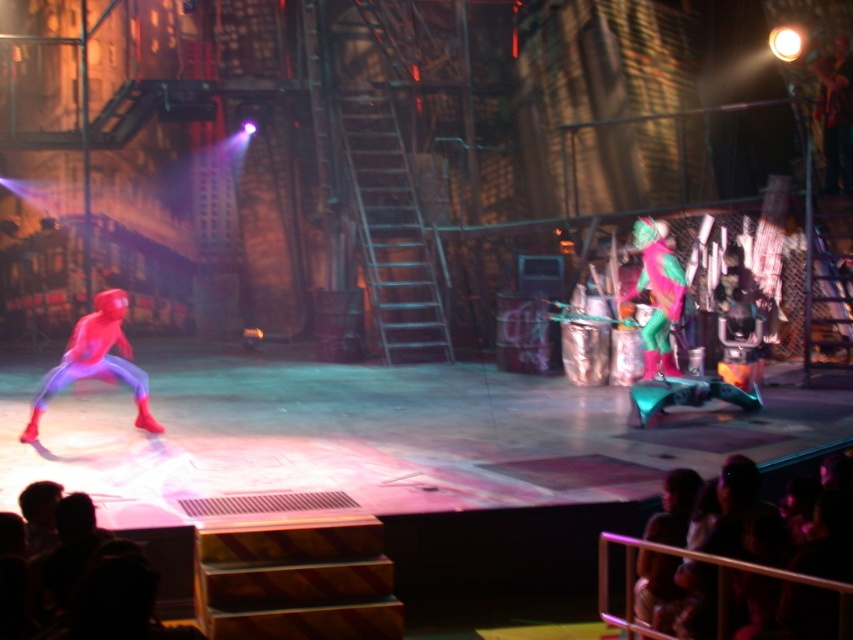
Question: Does shiny red suit at left have a larger size compared to neon green fabric costume at center?

Choices:
 (A) yes
 (B) no

Answer: (B)

Question: Can you confirm if shiny red suit at left is smaller than neon green fabric costume at center?

Choices:
 (A) yes
 (B) no

Answer: (A)

Question: Which point is closer to the camera taking this photo?

Choices:
 (A) (88, 346)
 (B) (664, 321)

Answer: (A)

Question: Can you confirm if silky black hair at lower right is positioned to the right of neon green fabric costume at center?

Choices:
 (A) yes
 (B) no

Answer: (B)

Question: Which point appears closest to the camera in this image?

Choices:
 (A) (57, 371)
 (B) (677, 371)
 (C) (837, 563)

Answer: (C)

Question: Which point appears closest to the camera in this image?

Choices:
 (A) (33, 422)
 (B) (666, 368)

Answer: (A)